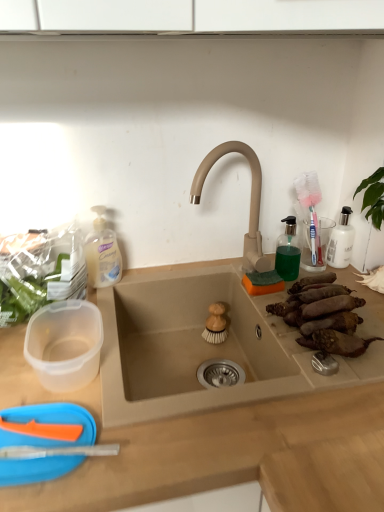
The image size is (384, 512). In order to click on brown rough sweet potatoes at right sink, arranged as the first food when viewed from the front in this screenshot , I will do `click(325, 318)`.

Measure the distance between point (362, 302) and camera.

The depth of point (362, 302) is 38.94 inches.

I want to click on translucent plastic soap dispenser at left, so click(x=102, y=251).

What do you see at coordinates (250, 200) in the screenshot? I see `beige matte faucet at center` at bounding box center [250, 200].

Where is `brown rough sweet potatoes at right sink, the first food from the right`? brown rough sweet potatoes at right sink, the first food from the right is located at coordinates (325, 318).

Who is taller, transparent plastic soap dispenser at upper right or translucent plastic soap dispenser at left?

translucent plastic soap dispenser at left is taller.

Considering the sizes of objects transparent plastic soap dispenser at upper right and translucent plastic soap dispenser at left in the image provided, who is thinner, transparent plastic soap dispenser at upper right or translucent plastic soap dispenser at left?

With smaller width is transparent plastic soap dispenser at upper right.

Consider the image. Is transparent plastic soap dispenser at upper right directly adjacent to translucent plastic soap dispenser at left?

They are not placed beside each other.

From the image's perspective, between transparent plastic soap dispenser at upper right and translucent plastic soap dispenser at left, who is located below?

transparent plastic soap dispenser at upper right is shown below in the image.

Looking at this image, who is taller, brown rough sweet potatoes at right sink, the first food from the right, or transparent plastic soap dispenser at upper right?

With more height is transparent plastic soap dispenser at upper right.

Which of these two, brown rough sweet potatoes at right sink, the 2th food positioned from the back, or transparent plastic soap dispenser at upper right, is wider?

brown rough sweet potatoes at right sink, the 2th food positioned from the back, is wider.

From the image's perspective, relative to transparent plastic soap dispenser at upper right, is brown rough sweet potatoes at right sink, acting as the second food starting from the left, above or below?

From the image's perspective, brown rough sweet potatoes at right sink, acting as the second food starting from the left, appears below transparent plastic soap dispenser at upper right.

How different are the orientations of beige matte sink at center and transparent plastic soap dispenser at upper right in degrees?

beige matte sink at center and transparent plastic soap dispenser at upper right are facing 0.0484 degrees away from each other.

From the image's perspective, which is above, beige matte sink at center or transparent plastic soap dispenser at upper right?

transparent plastic soap dispenser at upper right, from the image's perspective.

Locate an element on the screen. Image resolution: width=384 pixels, height=512 pixels. countertop in front of the transparent plastic soap dispenser at upper right is located at coordinates (216, 449).

Is wooden brush at sink, the second food when ordered from front to back, surrounded by transparent plastic soap dispenser at upper right?

No, wooden brush at sink, the second food when ordered from front to back, is not a part of transparent plastic soap dispenser at upper right.

Could you tell me if transparent plastic soap dispenser at upper right is turned towards wooden brush at sink, which ranks as the 1th food in back-to-front order?

No, transparent plastic soap dispenser at upper right is not facing towards wooden brush at sink, which ranks as the 1th food in back-to-front order.

Which of these two, transparent plastic soap dispenser at upper right or wooden brush at sink, positioned as the second food in right-to-left order, stands taller?

transparent plastic soap dispenser at upper right is taller.

Looking at this image, measure the distance between transparent plastic soap dispenser at upper right and wooden brush at sink, arranged as the 1th food when viewed from the left.

23.41 centimeters.

Is brown rough sweet potatoes at right sink, acting as the second food starting from the left, positioned far away from translucent plastic soap dispenser at left?

No, brown rough sweet potatoes at right sink, acting as the second food starting from the left, is in close proximity to translucent plastic soap dispenser at left.

Does brown rough sweet potatoes at right sink, the 2th food positioned from the back, have a lesser width compared to translucent plastic soap dispenser at left?

In fact, brown rough sweet potatoes at right sink, the 2th food positioned from the back, might be wider than translucent plastic soap dispenser at left.

From a real-world perspective, is brown rough sweet potatoes at right sink, the first food from the right, located higher than translucent plastic soap dispenser at left?

Actually, brown rough sweet potatoes at right sink, the first food from the right, is physically below translucent plastic soap dispenser at left in the real world.

From the image's perspective, is brown rough sweet potatoes at right sink, the first food from the right, located above or below translucent plastic soap dispenser at left?

From the image's perspective, brown rough sweet potatoes at right sink, the first food from the right, appears below translucent plastic soap dispenser at left.

Which is more distant, (x=276, y=261) or (x=293, y=315)?

The point (x=276, y=261) is behind.

Can you confirm if transparent plastic soap dispenser at upper right is positioned to the right of brown rough sweet potatoes at right sink, the 2th food positioned from the back?

No.

From the image's perspective, is transparent plastic soap dispenser at upper right above or below brown rough sweet potatoes at right sink, acting as the second food starting from the left?

transparent plastic soap dispenser at upper right is situated higher than brown rough sweet potatoes at right sink, acting as the second food starting from the left, in the image.

In the scene shown: Does transparent plastic soap dispenser at upper right contain brown rough sweet potatoes at right sink, the 2th food positioned from the back?

No.

Between translucent plastic soap dispenser at left and wooden brush at sink, the second food when ordered from front to back, which one appears on the right side from the viewer's perspective?

wooden brush at sink, the second food when ordered from front to back, is more to the right.

Does translucent plastic soap dispenser at left have a lesser height compared to wooden brush at sink, the second food when ordered from front to back?

No.

From the image's perspective, is translucent plastic soap dispenser at left over wooden brush at sink, positioned as the second food in right-to-left order?

Yes, from the image's perspective, translucent plastic soap dispenser at left is above wooden brush at sink, positioned as the second food in right-to-left order.

Between translucent plastic soap dispenser at left and wooden brush at sink, the second food when ordered from front to back, which one has larger width?

With larger width is translucent plastic soap dispenser at left.

At what (x,y) coordinates should I click in order to perform the action: click on toiletry below the translucent plastic soap dispenser at left (from the image's perspective). Please return your answer as a coordinate pair (x, y). This screenshot has height=512, width=384. Looking at the image, I should click on (288, 251).

The height and width of the screenshot is (512, 384). In order to click on the 1st food positioned below the transparent plastic soap dispenser at upper right (from a real-world perspective) in this screenshot , I will do `click(325, 318)`.

From the image, which object appears to be farther from brown rough sweet potatoes at right sink, the first food from the right, transparent plastic soap dispenser at upper right or translucent plastic soap dispenser at left?

translucent plastic soap dispenser at left lies further to brown rough sweet potatoes at right sink, the first food from the right, than the other object.

When comparing their distances from wooden brush at sink, the second food when ordered from front to back, does translucent plastic soap dispenser at left or transparent plastic soap dispenser at upper right seem closer?

transparent plastic soap dispenser at upper right is closer to wooden brush at sink, the second food when ordered from front to back.

Considering their positions, is transparent plastic soap dispenser at upper right positioned further to translucent plastic soap dispenser at left than beige matte faucet at center?

The object further to translucent plastic soap dispenser at left is transparent plastic soap dispenser at upper right.

Estimate the real-world distances between objects in this image. Which object is further from beige matte faucet at center, translucent plastic soap dispenser at left or brown rough sweet potatoes at right sink, arranged as the first food when viewed from the front?

translucent plastic soap dispenser at left is positioned further to the anchor beige matte faucet at center.

Which object lies nearer to the anchor point transparent plastic soap dispenser at upper right, brown rough sweet potatoes at right sink, acting as the second food starting from the left, or beige matte faucet at center?

beige matte faucet at center is closer to transparent plastic soap dispenser at upper right.

From the image, which object appears to be nearer to brown rough sweet potatoes at right sink, the 2th food positioned from the back, wooden brush at sink, positioned as the second food in right-to-left order, or transparent plastic soap dispenser at upper right?

Based on the image, transparent plastic soap dispenser at upper right appears to be nearer to brown rough sweet potatoes at right sink, the 2th food positioned from the back.

When comparing their distances from beige matte sink at center, does transparent plastic soap dispenser at upper right or beige matte faucet at center seem further?

Based on the image, transparent plastic soap dispenser at upper right appears to be further to beige matte sink at center.

Which object lies nearer to the anchor point brown rough sweet potatoes at right sink, the first food from the right, translucent plastic soap dispenser at left or beige matte faucet at center?

beige matte faucet at center is positioned closer to the anchor brown rough sweet potatoes at right sink, the first food from the right.

Image resolution: width=384 pixels, height=512 pixels. I want to click on tap situated between translucent plastic soap dispenser at left and brown rough sweet potatoes at right sink, the 2th food positioned from the back, from left to right, so click(x=250, y=200).

Find the location of a particular element. cleaning product between beige matte sink at center and wooden brush at sink, positioned as the second food in right-to-left order, along the z-axis is located at coordinates (102, 251).

Where is `countertop between translucent plastic soap dispenser at left and brown rough sweet potatoes at right sink, the 2th food positioned from the back, from left to right`? Image resolution: width=384 pixels, height=512 pixels. countertop between translucent plastic soap dispenser at left and brown rough sweet potatoes at right sink, the 2th food positioned from the back, from left to right is located at coordinates (216, 449).

Image resolution: width=384 pixels, height=512 pixels. I want to click on tap between brown rough sweet potatoes at right sink, the 2th food positioned from the back, and transparent plastic soap dispenser at upper right from front to back, so click(250, 200).